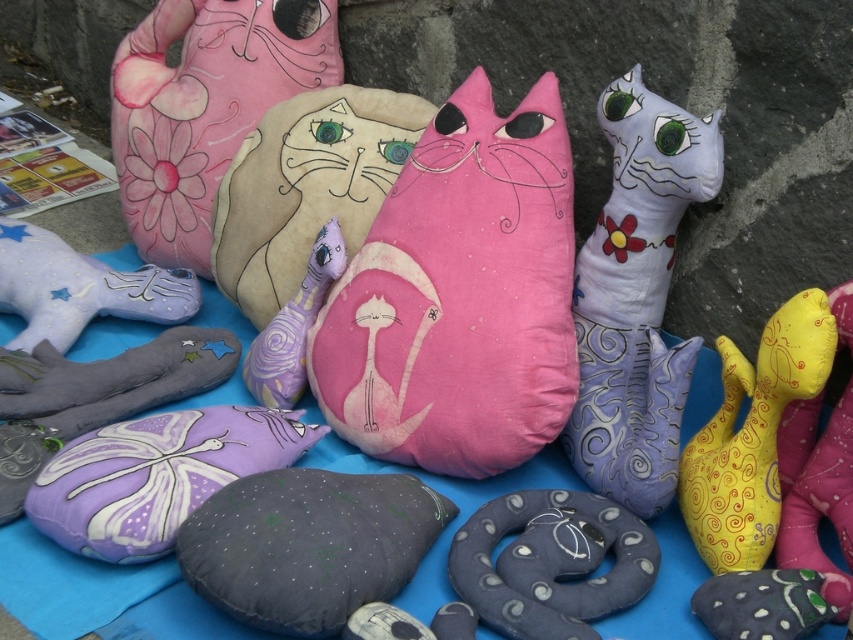
Question: Which object appears closest to the camera in this image?

Choices:
 (A) matte pink fabric cat at upper left
 (B) purple fabric cat at center
 (C) soft pastel cat at center

Answer: (B)

Question: Which object is the farthest from the purple fabric butterfly at center?

Choices:
 (A) dark gray fabric pillow at center
 (B) purple fabric whale at left
 (C) purple fabric cat at center
 (D) matte pink fabric cat at center

Answer: (B)

Question: Which object is farther from the camera taking this photo?

Choices:
 (A) matte white cat at center
 (B) matte pink fabric cat at center
 (C) matte pink fabric cat at upper left

Answer: (C)

Question: Is matte pink fabric cat at upper left thinner than purple fabric cat at center?

Choices:
 (A) no
 (B) yes

Answer: (A)

Question: Does purple fabric butterfly at center appear over purple fabric whale at left?

Choices:
 (A) no
 (B) yes

Answer: (A)

Question: Observing the image, what is the correct spatial positioning of matte pink fabric cat at center in reference to dark gray fabric pillow at center?

Choices:
 (A) below
 (B) above

Answer: (B)